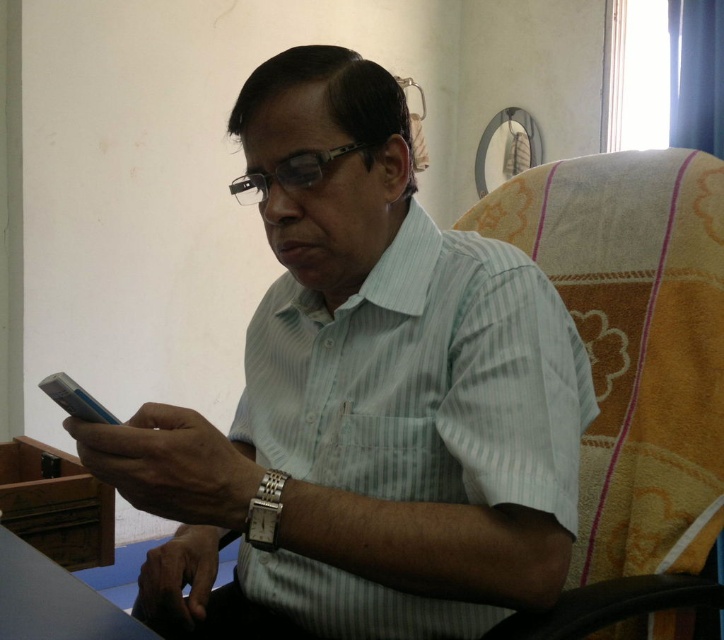
You are a fashion designer observing the scene. You need to decide whether the white striped shirt at center can be seen by someone standing behind the beige fabric swivel chair at right. Based on their positions, can the shirt be visible?

The white striped shirt at center is below the beige fabric swivel chair at right, so someone standing behind the chair would be able to see the shirt since it is positioned lower than the chair.

You are a furniture designer assessing the ergonomics of the beige fabric swivel chair at right and the smooth wooden table at lower left. Which object is taller?

The beige fabric swivel chair at right is taller than the smooth wooden table at lower left according to the description.

Based on the photo, you are a delivery person who needs to place a package on the smooth wooden table at lower left. However, the white striped shirt at center is blocking the way. Can you move the shirt to access the table?

The smooth wooden table at lower left is behind the white striped shirt at center, so you cannot access the table without moving the shirt first.